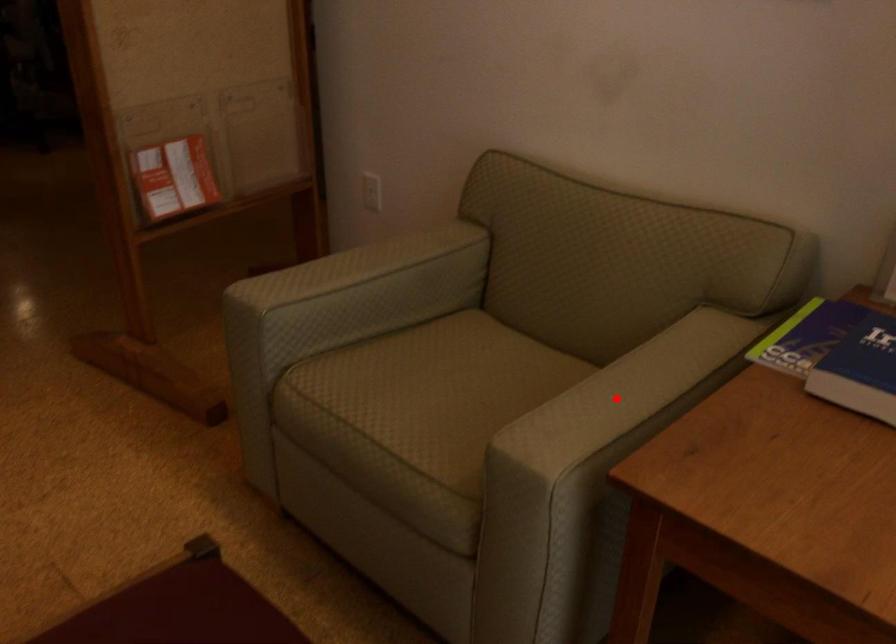
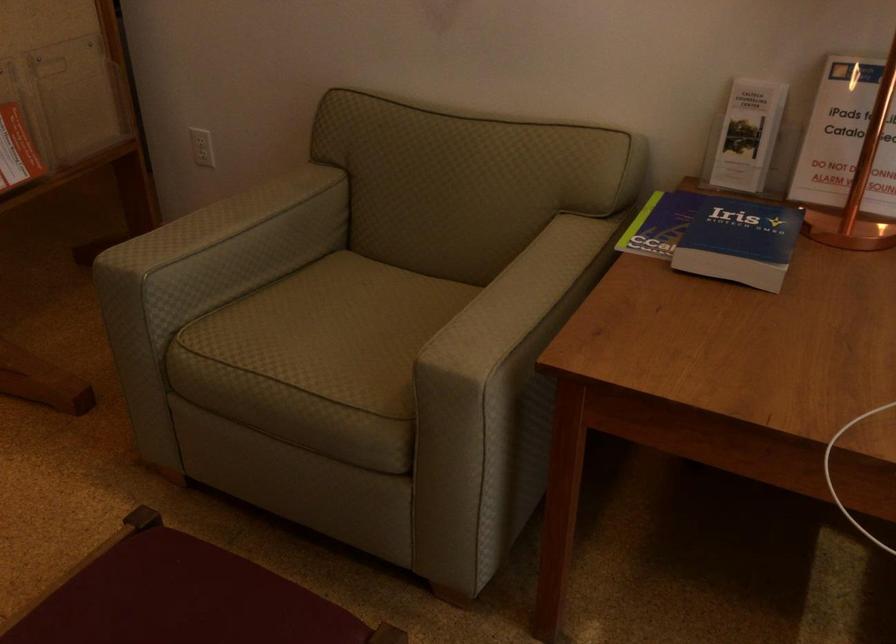
Find the pixel in the second image that matches the highlighted location in the first image.

(515, 299)